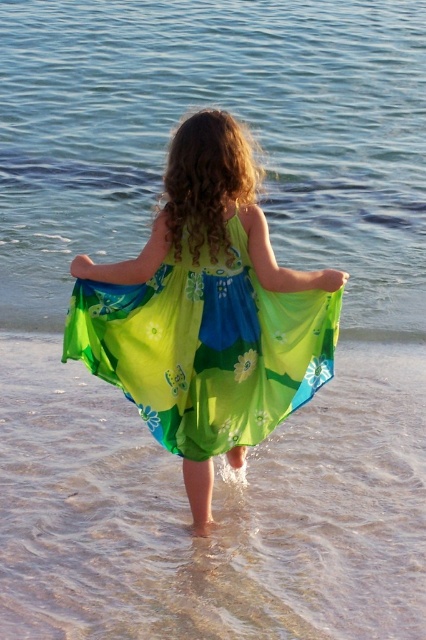
Is translucent blue water at center shorter than translucent sand at lower center?

No.

Which is below, translucent blue water at center or translucent sand at lower center?

translucent sand at lower center is below.

Who is more distant from viewer, [195,108] or [8,506]?

The point [195,108] is more distant.

Locate an element on the screen. This screenshot has width=426, height=640. translucent blue water at center is located at coordinates (232, 113).

Is translucent sand at lower center further to the viewer compared to green sheer dress at center?

That is False.

The image size is (426, 640). Identify the location of translucent sand at lower center. (213, 509).

The height and width of the screenshot is (640, 426). I want to click on translucent sand at lower center, so click(213, 509).

Is point (74, 243) behind point (192, 268)?

Yes, it is.

Is translucent blue water at center positioned in front of green sheer dress at center?

No, translucent blue water at center is further to the viewer.

Is point (253, 28) positioned after point (204, 365)?

That is True.

Identify the location of translucent blue water at center. (232, 113).